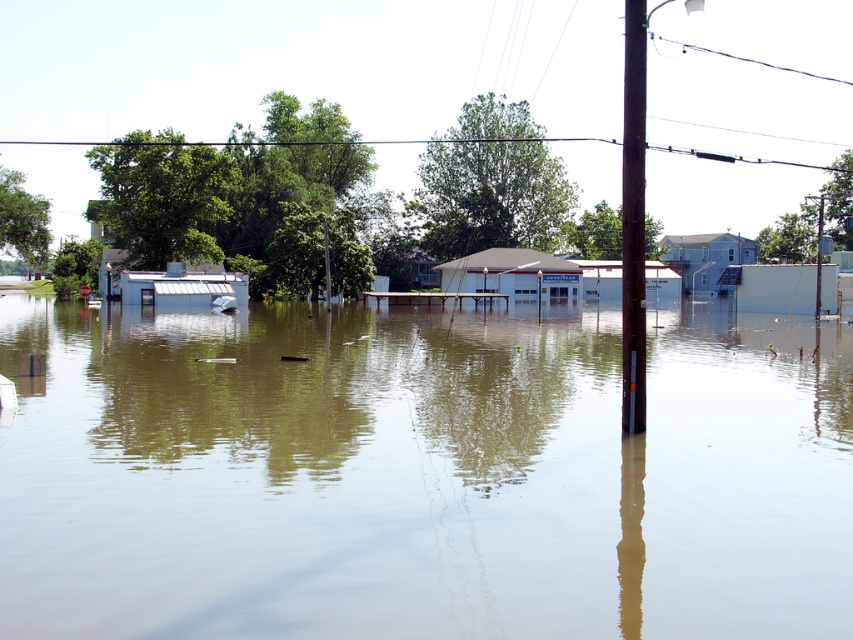
Question: In this image, where is brown murky water at center located relative to smooth brown wooden pole at center?

Choices:
 (A) above
 (B) below

Answer: (B)

Question: Which of the following is the closest to the observer?

Choices:
 (A) brown wooden pole at center
 (B) smooth brown wooden pole at center
 (C) brown murky water at center

Answer: (C)

Question: Which point is closer to the camera?

Choices:
 (A) smooth brown wooden pole at center
 (B) brown wooden pole at center
 (C) brown murky water at center

Answer: (C)

Question: Can you confirm if brown wooden pole at center is positioned below smooth brown wooden pole at center?

Choices:
 (A) no
 (B) yes

Answer: (B)

Question: Does brown murky water at center appear on the left side of brown wooden pole at center?

Choices:
 (A) yes
 (B) no

Answer: (A)

Question: Among these objects, which one is nearest to the camera?

Choices:
 (A) brown murky water at center
 (B) brown wooden pole at center
 (C) smooth brown wooden pole at center

Answer: (A)